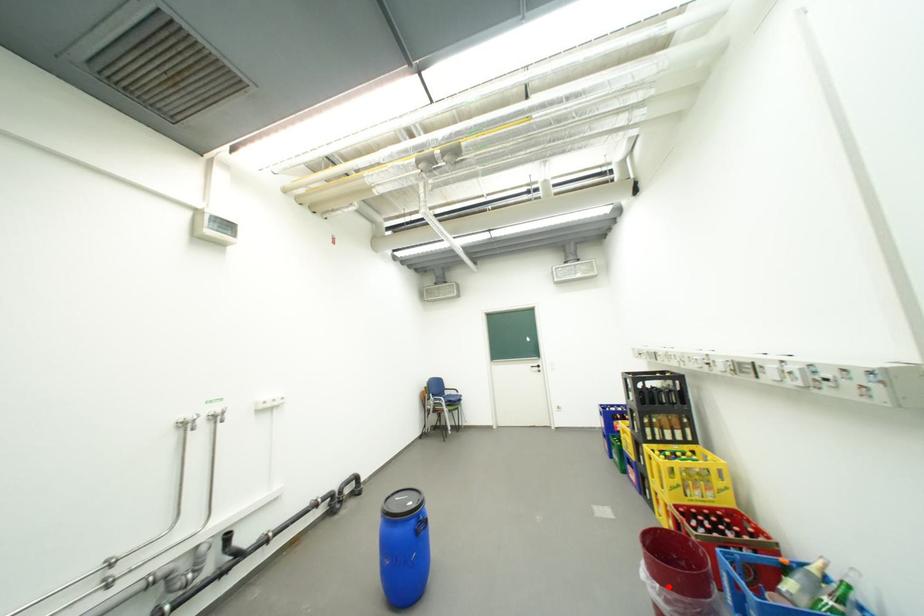
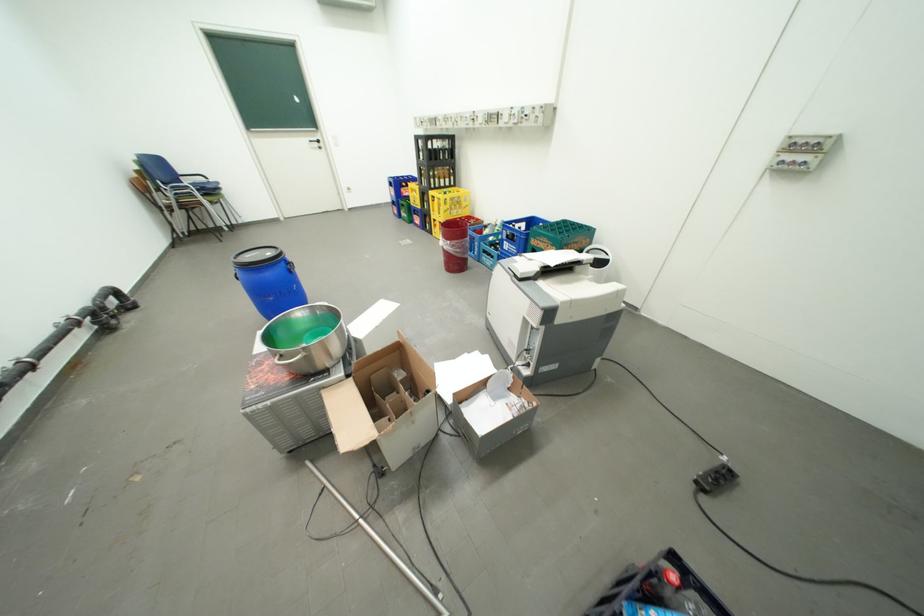
Find the pixel in the second image that matches the highlighted location in the first image.

(459, 243)